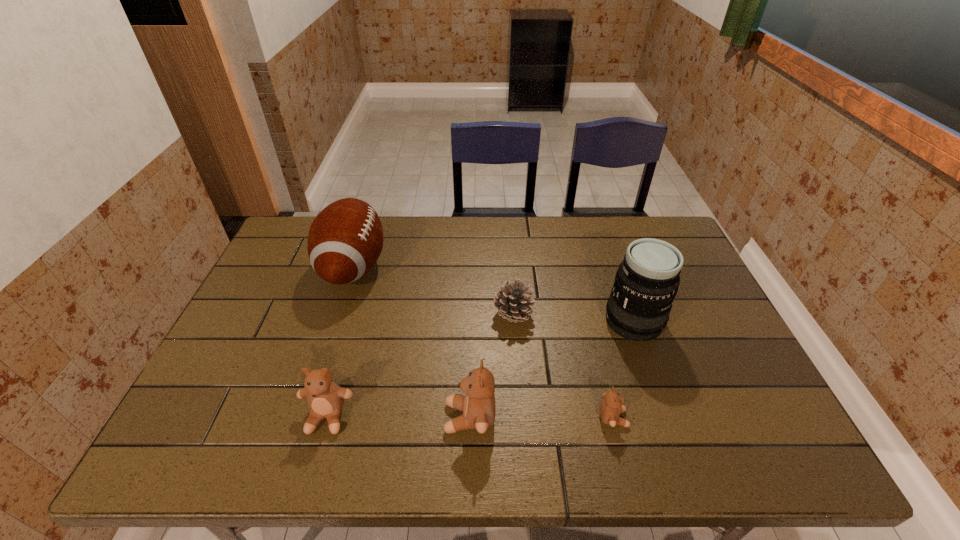
This screenshot has height=540, width=960. I want to click on vacant space that's between the rightmost object and the second teddy bear from right to left, so click(x=552, y=369).

The image size is (960, 540). I want to click on free point between the football and the fourth object from left to right, so click(x=433, y=291).

Locate an element on the screen. The height and width of the screenshot is (540, 960). empty space that is in between the second teddy bear from left to right and the third shortest object is located at coordinates (398, 417).

At what (x,y) coordinates should I click in order to perform the action: click on object that is the second closest one to the telephoto lens. Please return your answer as a coordinate pair (x, y). Looking at the image, I should click on (513, 301).

At what (x,y) coordinates should I click in order to perform the action: click on the third closest object to the fifth tallest object. Please return your answer as a coordinate pair (x, y). This screenshot has width=960, height=540. Looking at the image, I should click on 611,406.

Image resolution: width=960 pixels, height=540 pixels. Find the location of `teddy bear identified as the third closest to the fourth object from left to right`. teddy bear identified as the third closest to the fourth object from left to right is located at coordinates (325, 398).

Identify the location of teddy bear object that ranks as the second closest to the second tallest teddy bear. This screenshot has width=960, height=540. (611, 406).

This screenshot has width=960, height=540. Find the location of `free region that satisfies the following two spatial constraints: 1. on the front side of the second shortest object; 2. on the front-facing side of the second teddy bear from right to left`. free region that satisfies the following two spatial constraints: 1. on the front side of the second shortest object; 2. on the front-facing side of the second teddy bear from right to left is located at coordinates (521, 417).

I want to click on free location that satisfies the following two spatial constraints: 1. on the laces of the football; 2. on the back side of the rightmost object, so click(x=335, y=321).